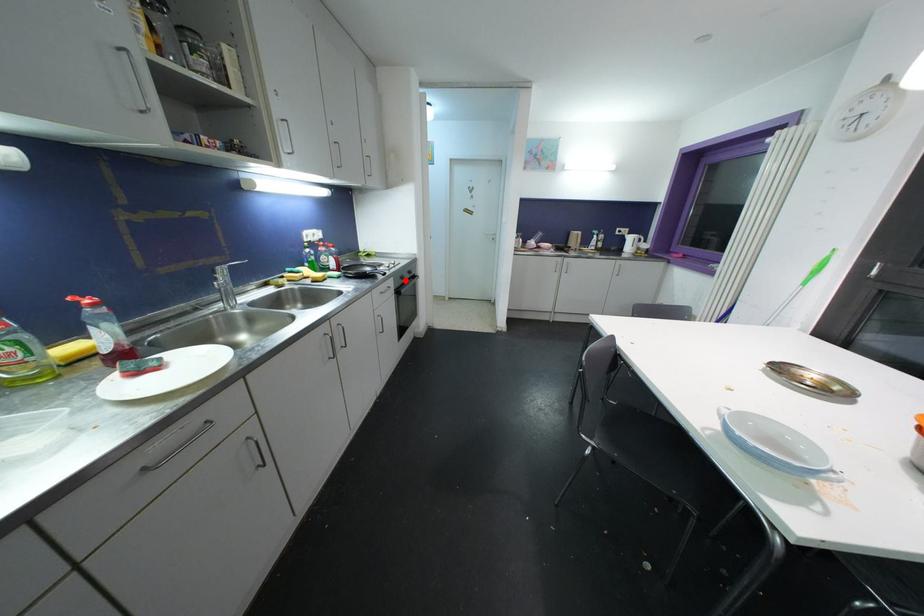
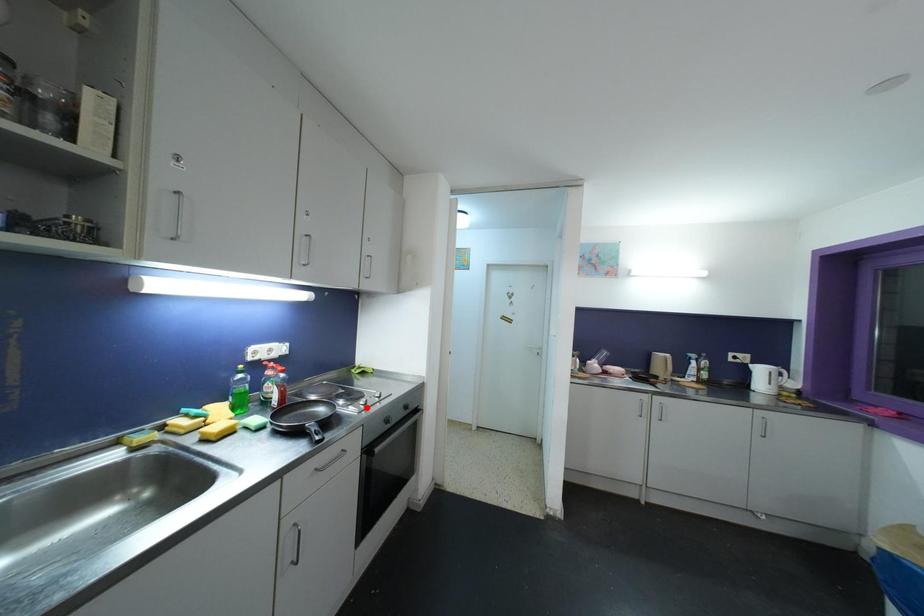
I am providing you with two images of the same scene from different viewpoints. A red point is marked on the first image and another point is marked on the second image. Does the point marked in image1 correspond to the same location as the one in image2?

No